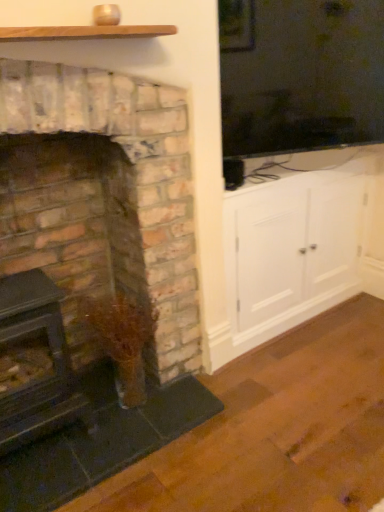
Question: Is white wood cabinet at right in front of or behind wooden plank at upper center in the image?

Choices:
 (A) front
 (B) behind

Answer: (B)

Question: In the image, is white wood cabinet at right on the left side or the right side of wooden plank at upper center?

Choices:
 (A) left
 (B) right

Answer: (B)

Question: Estimate the real-world distances between objects in this image. Which object is closer to the white wood cabinet at right?

Choices:
 (A) rustic brick fireplace at left, positioned as the 2th fireplace in right-to-left order
 (B) wooden plank at upper center
 (C) rustic brick fireplace at left, placed as the 1th fireplace when sorted from right to left

Answer: (C)

Question: Which of these objects is positioned farthest from the wooden plank at upper center?

Choices:
 (A) rustic brick fireplace at left, placed as the 1th fireplace when sorted from right to left
 (B) white wood cabinet at right
 (C) rustic brick fireplace at left, which appears as the 1th fireplace when viewed from the left

Answer: (B)